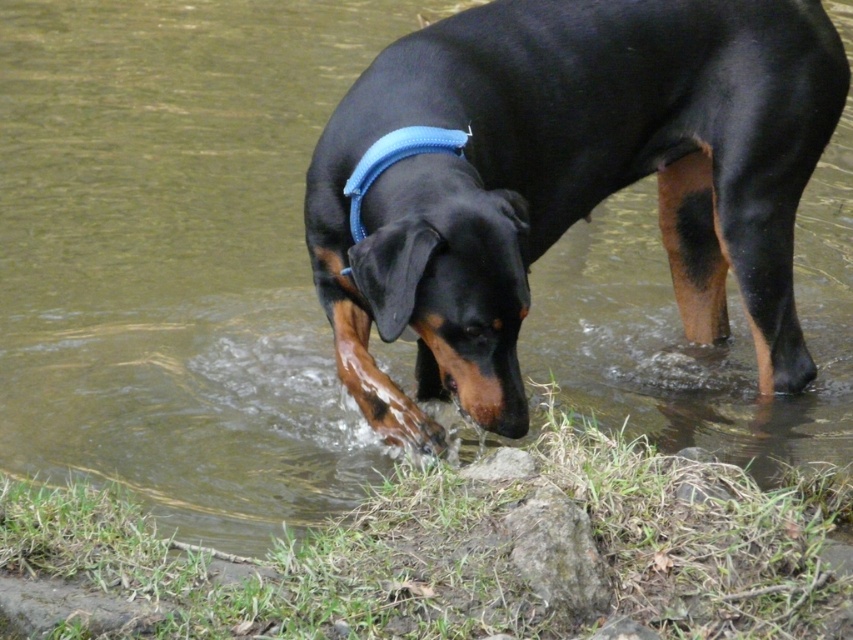
Does black shiny dog at center lie behind blue fabric neckband at center?

That is False.

Between black shiny dog at center and blue fabric neckband at center, which one appears on the left side from the viewer's perspective?

blue fabric neckband at center

Between point (694, 8) and point (374, 150), which one is positioned in front?

Positioned in front is point (374, 150).

Locate an element on the screen. black shiny dog at center is located at coordinates (567, 180).